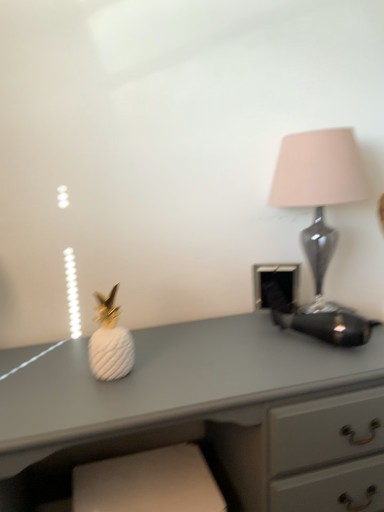
Question: From a real-world perspective, does matte glass lamp at right sit lower than white matte pineapple at center?

Choices:
 (A) no
 (B) yes

Answer: (A)

Question: Is matte glass lamp at right smaller than white matte pineapple at center?

Choices:
 (A) no
 (B) yes

Answer: (A)

Question: Is matte glass lamp at right beside white matte pineapple at center?

Choices:
 (A) yes
 (B) no

Answer: (B)

Question: From the image's perspective, is matte glass lamp at right on top of white matte pineapple at center?

Choices:
 (A) yes
 (B) no

Answer: (A)

Question: Is the position of matte glass lamp at right more distant than that of white matte pineapple at center?

Choices:
 (A) yes
 (B) no

Answer: (A)

Question: Based on their sizes in the image, would you say matte glass lamp at right is bigger or smaller than white matte pineapple at center?

Choices:
 (A) big
 (B) small

Answer: (A)

Question: Considering the positions of matte glass lamp at right and white matte pineapple at center in the image, is matte glass lamp at right wider or thinner than white matte pineapple at center?

Choices:
 (A) wide
 (B) thin

Answer: (A)

Question: Choose the correct answer: Is matte glass lamp at right inside white matte pineapple at center or outside it?

Choices:
 (A) outside
 (B) inside

Answer: (A)

Question: Visually, is matte glass lamp at right positioned to the left or to the right of white matte pineapple at center?

Choices:
 (A) left
 (B) right

Answer: (B)

Question: Is white matte pineapple at left wider or thinner than matte glass lamp at right?

Choices:
 (A) thin
 (B) wide

Answer: (B)

Question: Visually, is white matte pineapple at left positioned to the left or to the right of matte glass lamp at right?

Choices:
 (A) right
 (B) left

Answer: (B)

Question: From a real-world perspective, relative to matte glass lamp at right, is white matte pineapple at left vertically above or below?

Choices:
 (A) below
 (B) above

Answer: (A)

Question: Looking at the image, does white matte pineapple at left seem bigger or smaller compared to matte glass lamp at right?

Choices:
 (A) big
 (B) small

Answer: (A)

Question: Is white matte pineapple at left in front of or behind white matte pineapple at center in the image?

Choices:
 (A) behind
 (B) front

Answer: (B)

Question: Looking at the image, does white matte pineapple at left seem bigger or smaller compared to white matte pineapple at center?

Choices:
 (A) big
 (B) small

Answer: (A)